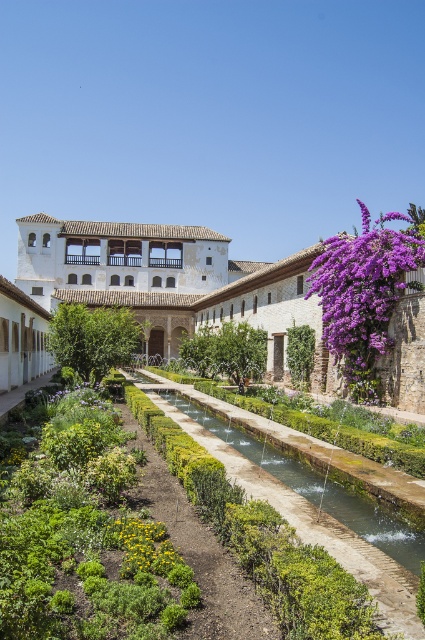
Question: Can you confirm if purple matte flowers at upper right is bigger than yellow matte flower at center?

Choices:
 (A) yes
 (B) no

Answer: (A)

Question: Which object appears farthest from the camera in this image?

Choices:
 (A) green mossy stone path at center
 (B) yellow matte flower at center
 (C) green leafy plant at center

Answer: (C)

Question: Is green mossy stone path at center below yellow matte flower at center?

Choices:
 (A) yes
 (B) no

Answer: (A)

Question: Based on their relative distances, which object is farther from the yellow matte flower at center?

Choices:
 (A) green mossy stone path at center
 (B) purple matte flowers at upper right

Answer: (B)

Question: Estimate the real-world distances between objects in this image. Which object is farther from the purple matte flowers at upper right?

Choices:
 (A) yellow matte flower at center
 (B) green mossy stone path at center
 (C) green leafy plant at center

Answer: (B)

Question: Is purple matte flowers at upper right wider than green leafy plant at center?

Choices:
 (A) yes
 (B) no

Answer: (A)